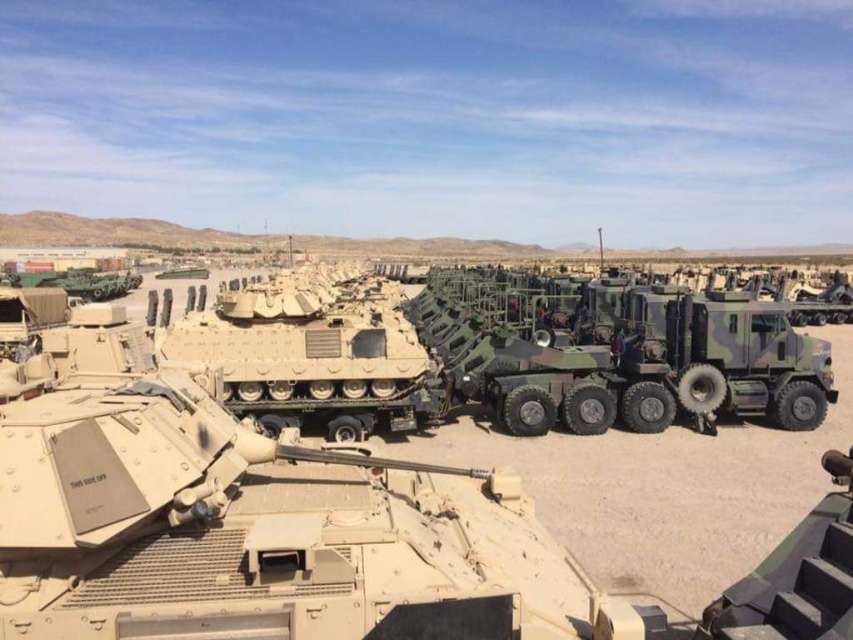
Measure the distance from tan matte tank at center to camouflage textured tank at center.

tan matte tank at center is 4.68 meters from camouflage textured tank at center.

Which of these two, tan matte tank at center or camouflage textured tank at center, stands taller?

camouflage textured tank at center is taller.

Which is in front, point (48, 461) or point (410, 390)?

Positioned in front is point (48, 461).

Image resolution: width=853 pixels, height=640 pixels. What are the coordinates of `tan matte tank at center` in the screenshot? It's located at (260, 531).